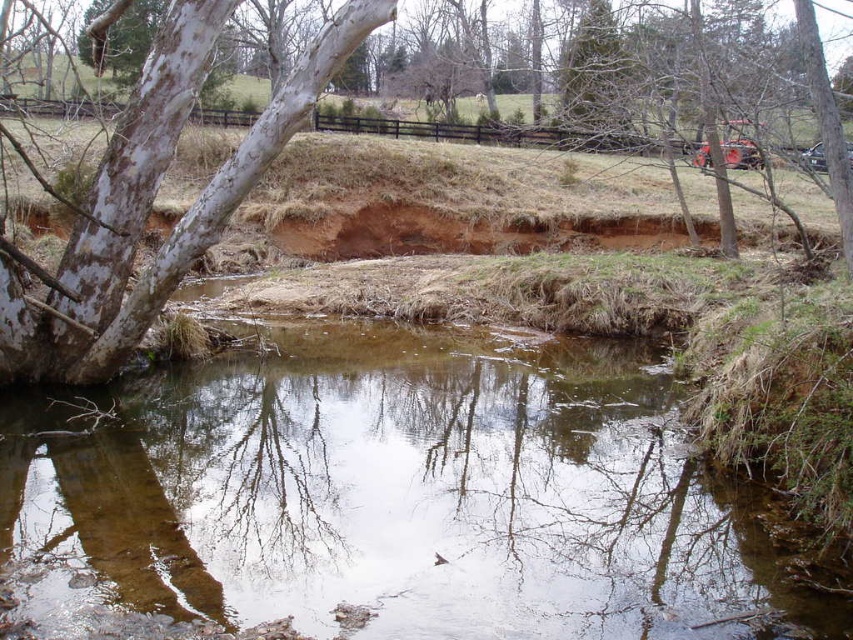
You are a hiker who wants to cross the stream using the white smooth bark tree at upper left. Can you step onto the clear water at center from the tree?

The clear water at center is located below the white smooth bark tree at upper left, so stepping onto the clear water at center from the tree would require descending downward, which may be difficult without a stable path.

You are a hiker who wants to cross the stream using a fallen tree trunk. You see the clear water at center and the white smooth bark tree at upper left. Which direction should you go to reach the tree trunk?

The clear water at center and white smooth bark tree at upper left are 10.42 feet apart from each other. To reach the tree trunk, you should go towards the white smooth bark tree at upper left as it is located in the upper left direction from the clear water at center.